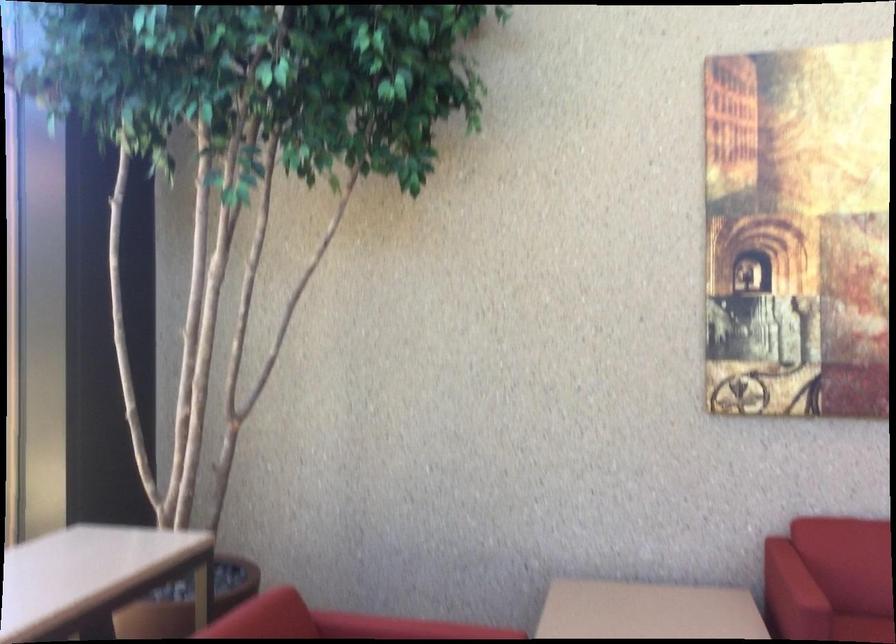
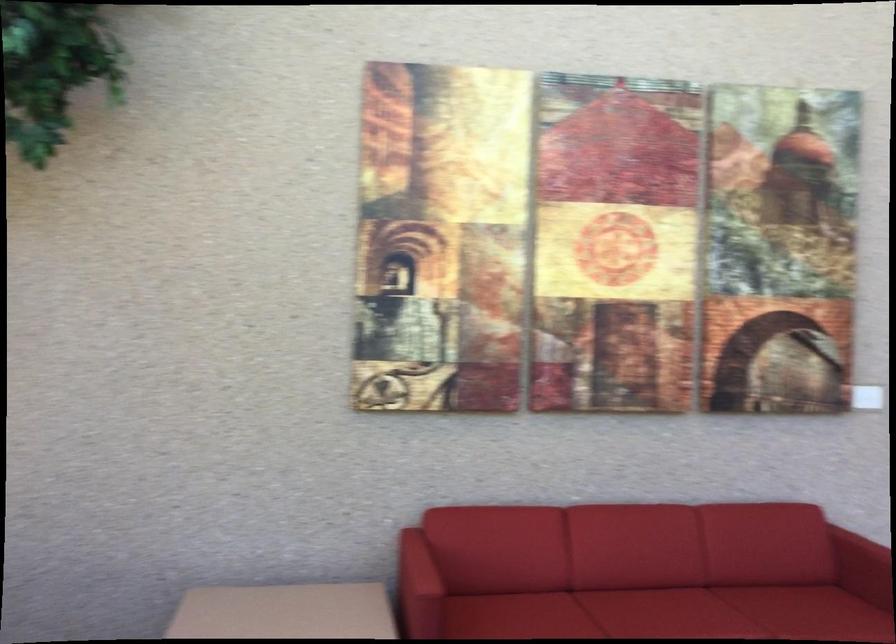
Where in the second image is the point corresponding to [796,570] from the first image?

(418, 564)